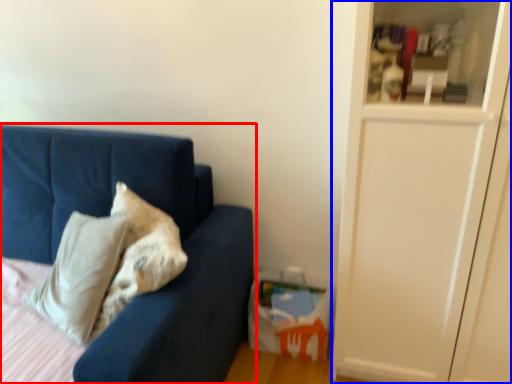
Question: Which object is further to the camera taking this photo, studio couch (highlighted by a red box) or glass door (highlighted by a blue box)?

Choices:
 (A) studio couch
 (B) glass door

Answer: (B)